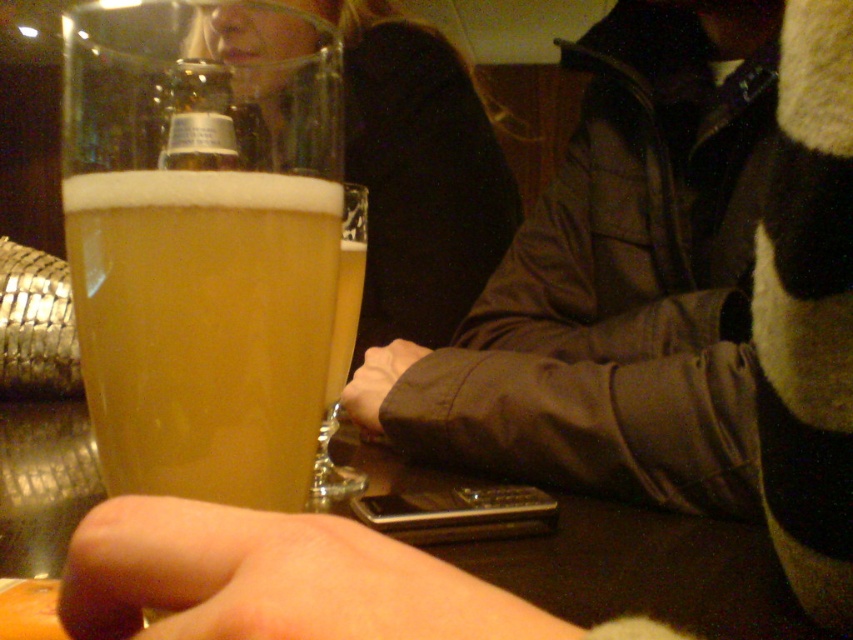
Does skinny flesh-toned hand at lower left have a greater width compared to translucent glass at center?

Yes.

Find the location of a particular element. This screenshot has height=640, width=853. skinny flesh-toned hand at lower left is located at coordinates (271, 580).

At what (x,y) coordinates should I click in order to perform the action: click on skinny flesh-toned hand at lower left. Please return your answer as a coordinate pair (x, y). The height and width of the screenshot is (640, 853). Looking at the image, I should click on (271, 580).

Is skinny flesh-toned hand at lower left taller than black sweater at upper center?

No.

Describe the element at coordinates (271, 580) in the screenshot. I see `skinny flesh-toned hand at lower left` at that location.

Who is more distant from viewer, [86,550] or [440,275]?

The point [440,275] is behind.

I want to click on skinny flesh-toned hand at lower left, so click(271, 580).

Is black sweater at upper center to the right of translucent glass at center from the viewer's perspective?

No, black sweater at upper center is not to the right of translucent glass at center.

Based on the photo, measure the distance between black sweater at upper center and camera.

They are 10.80 inches apart.

Identify the location of black sweater at upper center. (x=418, y=173).